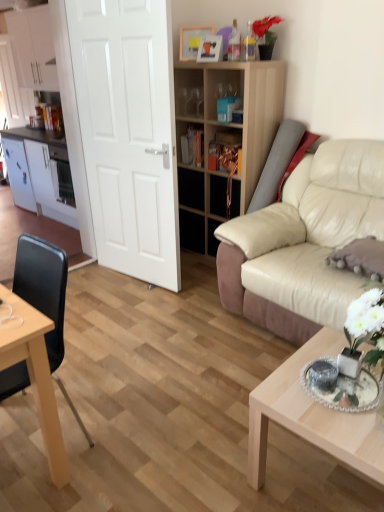
Locate an element on the screen. free space between white matte door at center and light wood/texture coffee table at lower right is located at coordinates (199, 339).